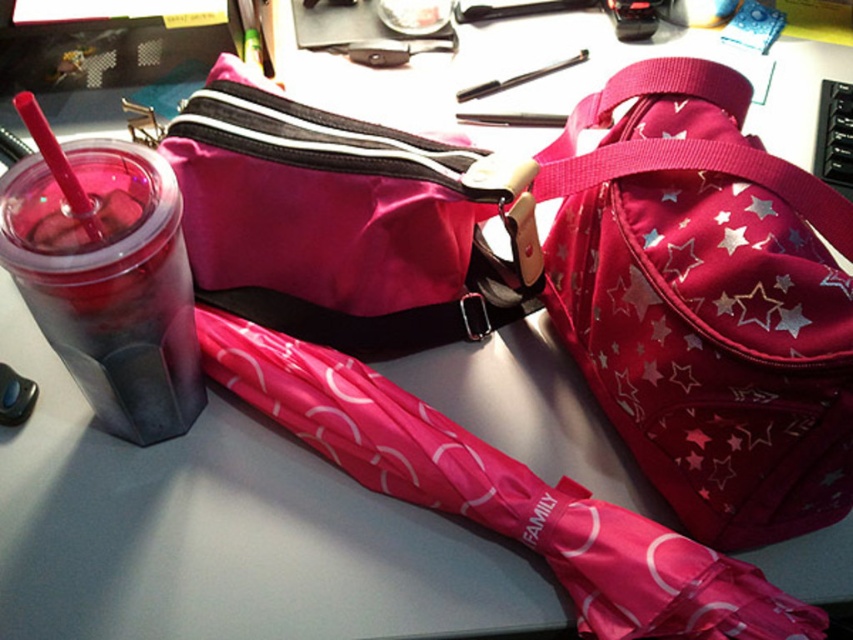
You are organizing items on a desk and need to place a new item between the shiny pink fabric bag at upper right and the metallic silver pen at upper center. Can you fit it there?

The shiny pink fabric bag at upper right is closer to the viewer than the metallic silver pen at upper center, so there is space between them to fit the new item.

You are organizing items on a desk and need to place a new item between the shiny pink fabric bag at upper right and the pink plastic straw at left. Considering their sizes, which item should be placed closer to the center of the desk?

The shiny pink fabric bag at upper right is larger than the pink plastic straw at left, so to balance the space, the pink plastic straw at left should be placed closer to the center of the desk.

You are trying to locate the shiny pink fabric bag at upper right on the desk. According to the coordinates given, where exactly is it positioned?

The shiny pink fabric bag at upper right is positioned at coordinates point (705, 301).